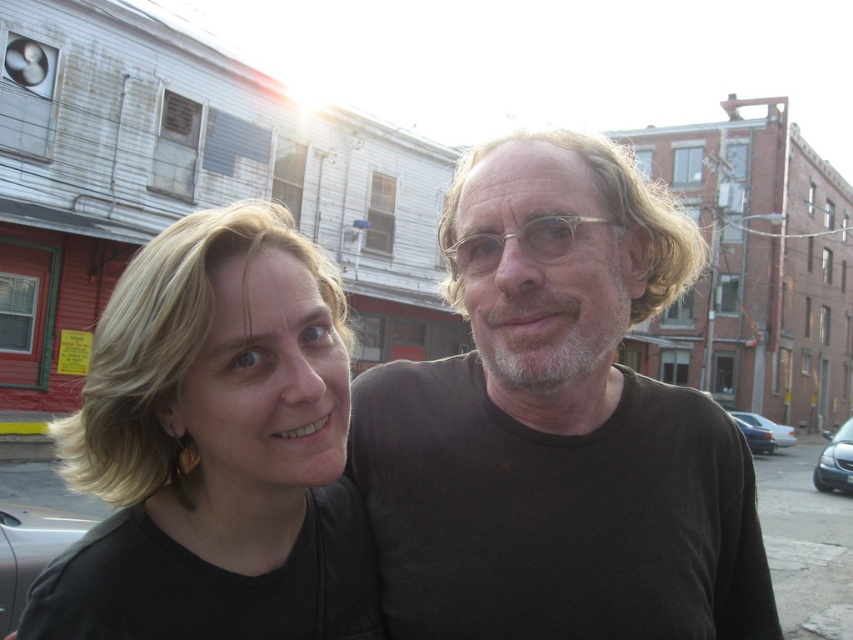
Question: Is silver metallic car at lower left positioned at the back of metallic silver sedan at lower right?

Choices:
 (A) yes
 (B) no

Answer: (B)

Question: Based on their relative distances, which object is nearer to the metallic silver sedan at lower right?

Choices:
 (A) matte black sedan at right
 (B) black matte shirt at center
 (C) silver metallic car at lower left

Answer: (A)

Question: Which of the following is the closest to the observer?

Choices:
 (A) (788, 426)
 (B) (755, 506)

Answer: (B)

Question: Does matte black hair at left appear over silver metallic car at lower left?

Choices:
 (A) no
 (B) yes

Answer: (B)

Question: Can you confirm if black matte shirt at center is positioned to the left of matte black hair at left?

Choices:
 (A) no
 (B) yes

Answer: (A)

Question: Which point is closer to the camera?

Choices:
 (A) metallic silver sedan at lower right
 (B) silver metallic car at lower left

Answer: (B)